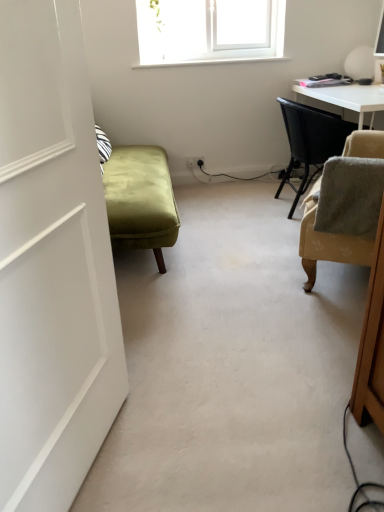
Locate an element on the screen. vacant space in between beige fabric chair at right, the 2th chair when ordered from front to back, and white matte door at left is located at coordinates (230, 303).